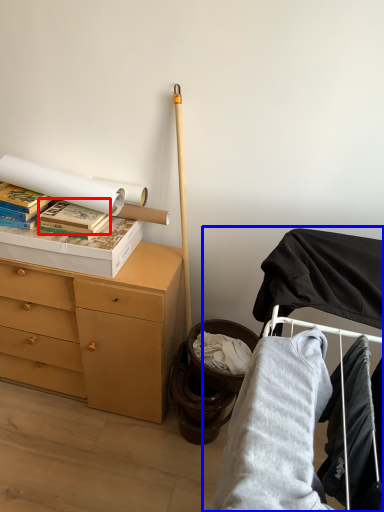
Question: Among these objects, which one is farthest to the camera, paperback book (highlighted by a red box) or bunk bed (highlighted by a blue box)?

Choices:
 (A) paperback book
 (B) bunk bed

Answer: (A)